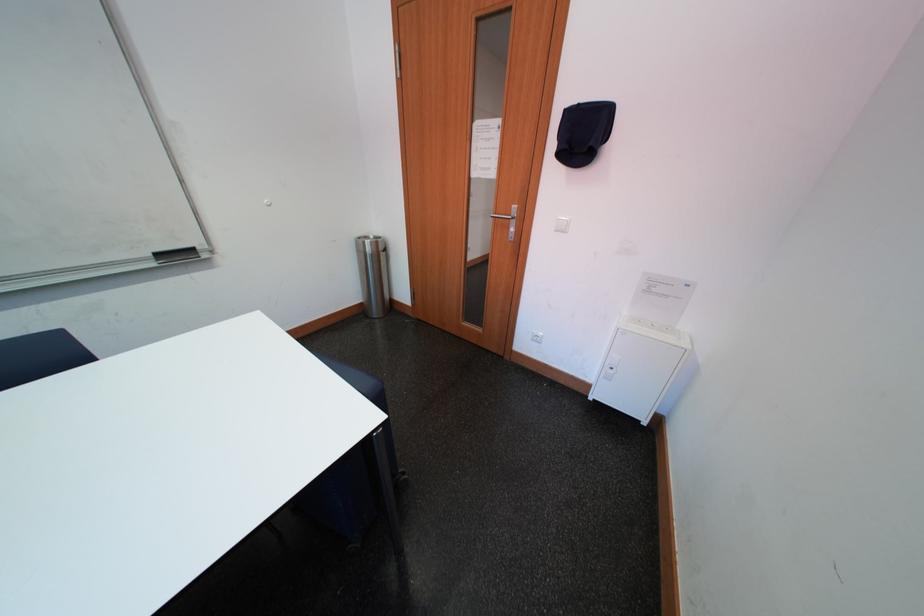
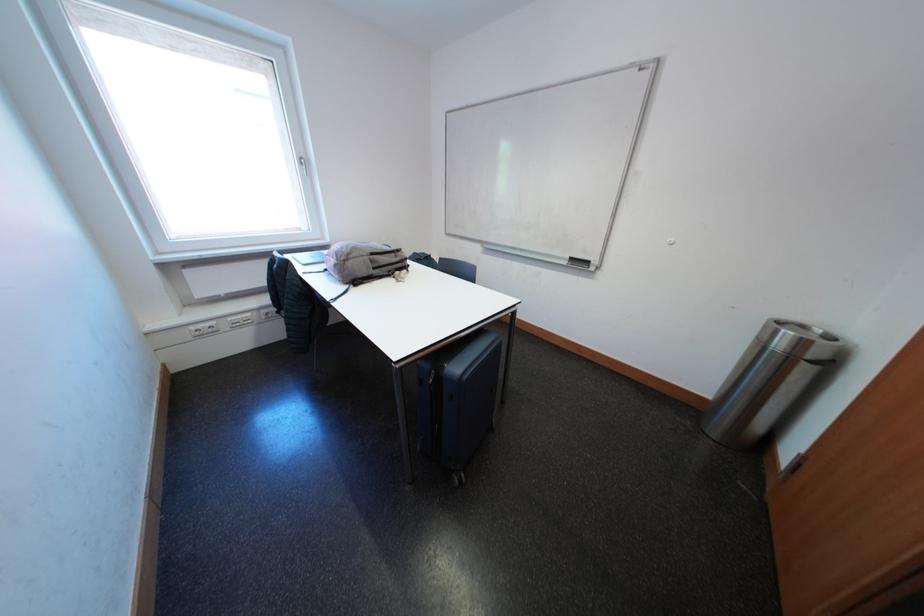
Locate, in the second image, the point that corresponds to (x=391, y=252) in the first image.

(821, 360)